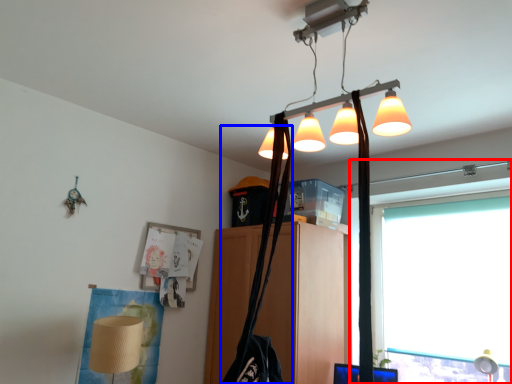
Question: Which object appears farthest to the camera in this image, window (highlighted by a red box) or shoulder bag (highlighted by a blue box)?

Choices:
 (A) window
 (B) shoulder bag

Answer: (A)